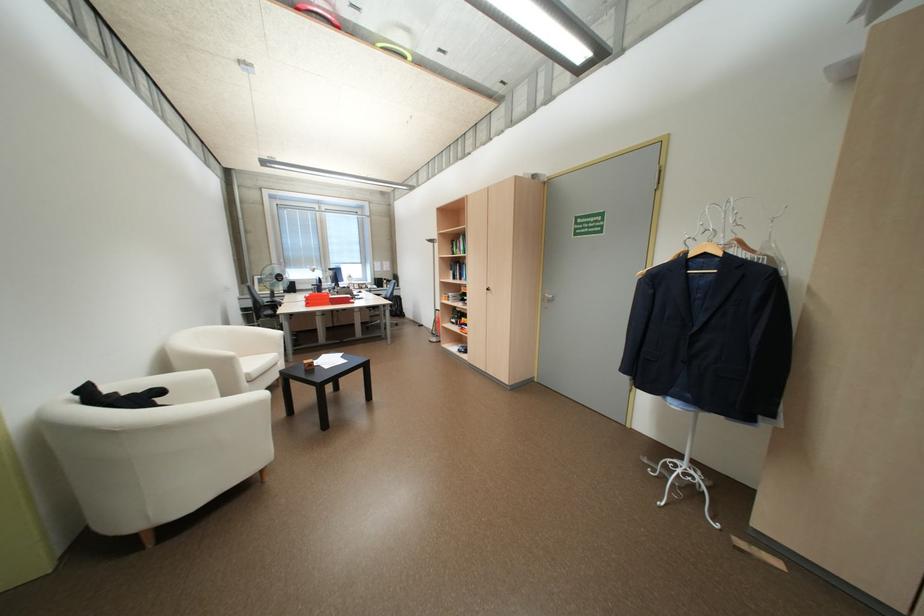
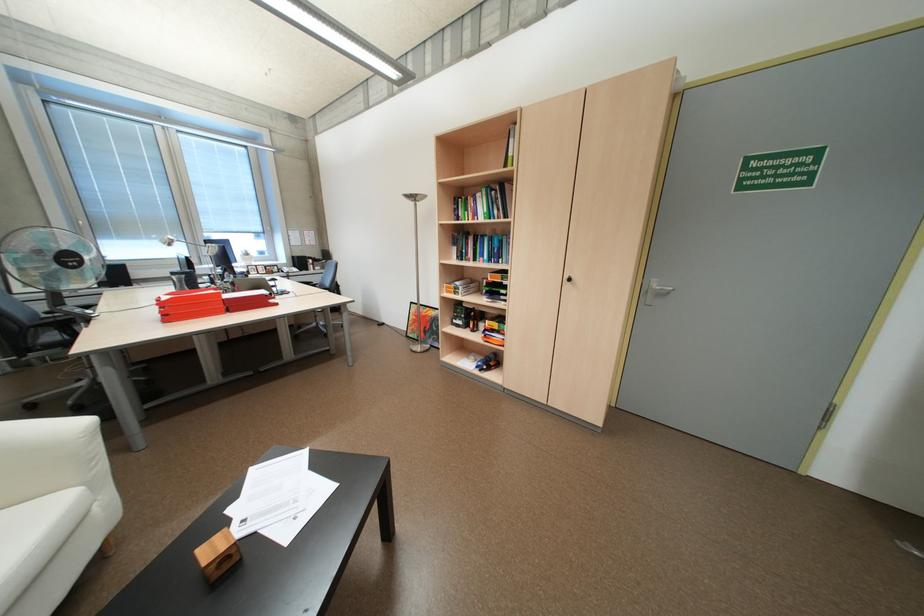
In the second image, find the point that corresponds to pixel 457 300 in the first image.

(465, 293)